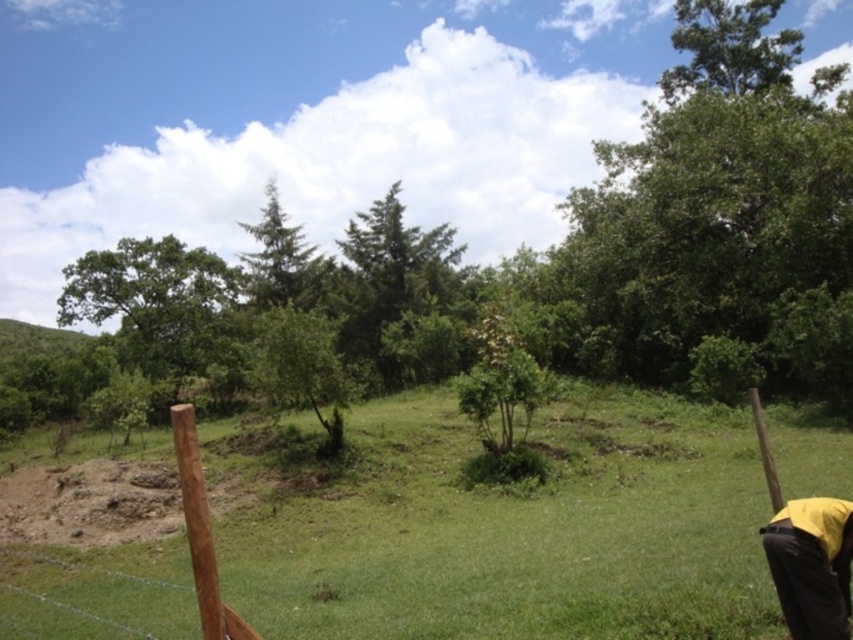
You are a gardener planning to plant a new flower bed. You have a limited amount of seeds and want to use them efficiently. Which area should you choose between the green grassy at center and the brown wooden post at lower left to plant the flowers for better visibility?

The green grassy at center is bigger than the brown wooden post at lower left, so planting flowers there would provide better visibility and utilize the space more effectively.